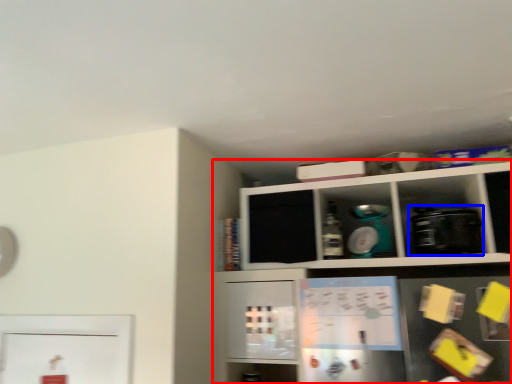
Question: Which of the following is the closest to the observer, shelf (highlighted by a red box) or appliance (highlighted by a blue box)?

Choices:
 (A) shelf
 (B) appliance

Answer: (A)